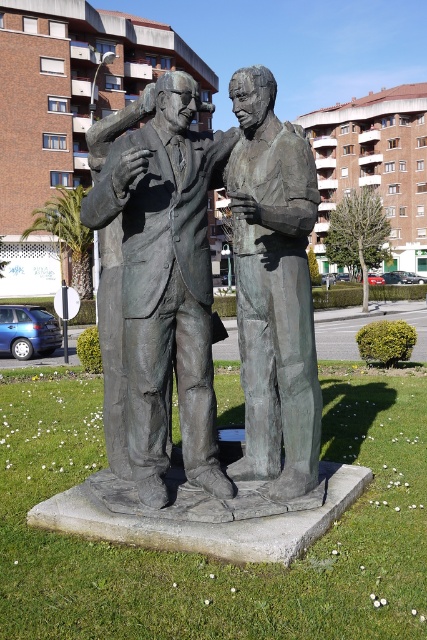
Question: Is bronze statue at center above bronze statue of man at center?

Choices:
 (A) yes
 (B) no

Answer: (B)

Question: Does bronze statue at center have a larger size compared to bronze statue of man at center?

Choices:
 (A) yes
 (B) no

Answer: (A)

Question: Which point is closer to the camera?

Choices:
 (A) bronze statue at center
 (B) bronze statue of man at center

Answer: (A)

Question: Considering the relative positions of bronze statue at center and bronze statue of man at center in the image provided, where is bronze statue at center located with respect to bronze statue of man at center?

Choices:
 (A) left
 (B) right

Answer: (A)